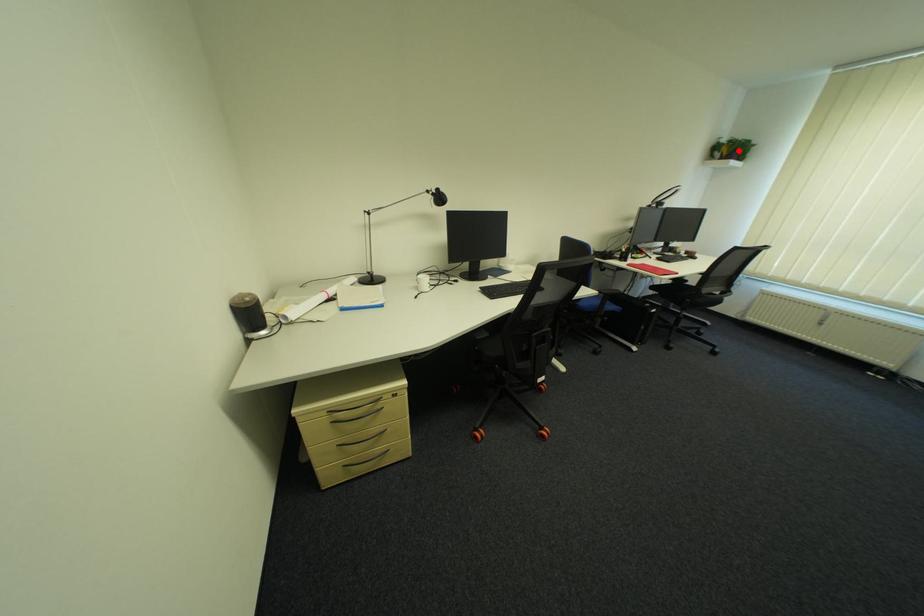
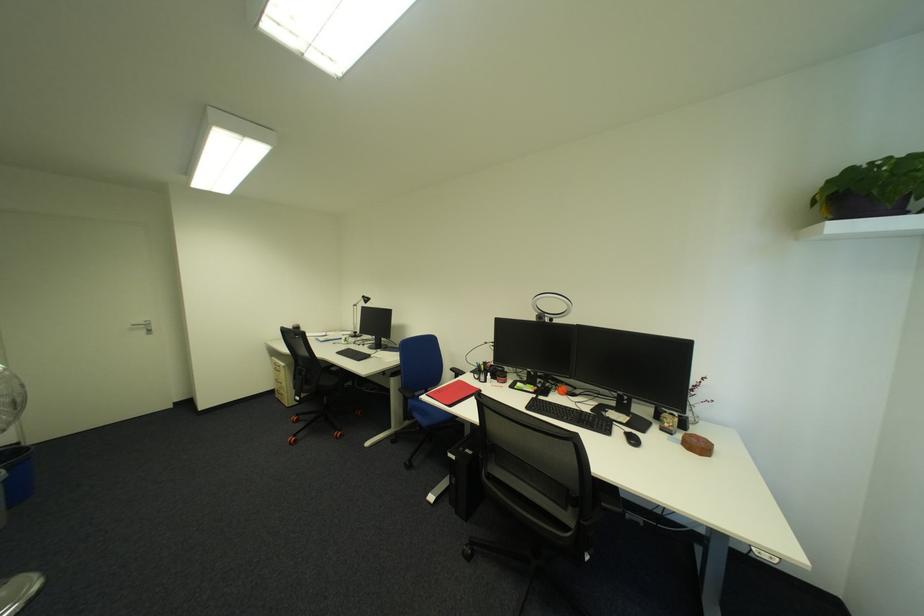
The point at the highlighted location is marked in the first image. Where is the corresponding point in the second image?

(831, 200)